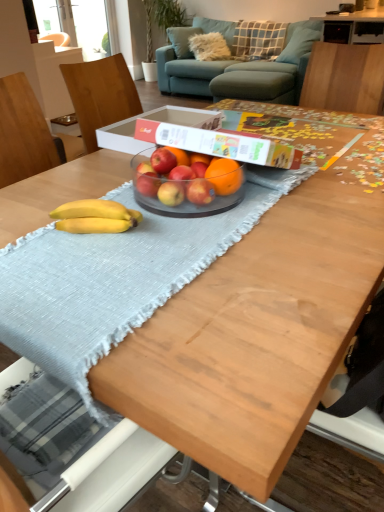
Question: Could you tell me if yellow matte bananas at center is facing red matte apple at center, acting as the fourth apple starting from the left?

Choices:
 (A) yes
 (B) no

Answer: (B)

Question: From a real-world perspective, is yellow matte bananas at center located beneath red matte apple at center, which is the 2th apple in right-to-left order?

Choices:
 (A) no
 (B) yes

Answer: (B)

Question: From the image's perspective, is yellow matte bananas at center under red matte apple at center, acting as the fourth apple starting from the left?

Choices:
 (A) no
 (B) yes

Answer: (B)

Question: Is yellow matte bananas at center at the left side of red matte apple at center, which is the 2th apple in right-to-left order?

Choices:
 (A) yes
 (B) no

Answer: (A)

Question: From the image's perspective, is yellow matte bananas at center on red matte apple at center, which is the 2th apple in right-to-left order?

Choices:
 (A) yes
 (B) no

Answer: (B)

Question: Based on their sizes in the image, would you say red matte apple at center, marked as the 5th apple in a left-to-right arrangement, is bigger or smaller than teal fabric couch at upper center?

Choices:
 (A) big
 (B) small

Answer: (B)

Question: From their relative heights in the image, would you say red matte apple at center, marked as the 1th apple in a right-to-left arrangement, is taller or shorter than teal fabric couch at upper center?

Choices:
 (A) short
 (B) tall

Answer: (A)

Question: From a real-world perspective, relative to teal fabric couch at upper center, is red matte apple at center, marked as the 5th apple in a left-to-right arrangement, vertically above or below?

Choices:
 (A) below
 (B) above

Answer: (B)

Question: In terms of width, does red matte apple at center, marked as the 5th apple in a left-to-right arrangement, look wider or thinner when compared to teal fabric couch at upper center?

Choices:
 (A) wide
 (B) thin

Answer: (B)

Question: From the image's perspective, is plaid fabric pillow at upper center, the second pillow from the front, positioned above or below blue fabric pillow at upper right, the 2th pillow in the back-to-front sequence?

Choices:
 (A) above
 (B) below

Answer: (A)

Question: Would you say plaid fabric pillow at upper center, placed as the 1th pillow when sorted from back to front, is to the left or to the right of blue fabric pillow at upper right, the 2th pillow in the back-to-front sequence, in the picture?

Choices:
 (A) right
 (B) left

Answer: (B)

Question: Is plaid fabric pillow at upper center, placed as the 1th pillow when sorted from back to front, situated inside blue fabric pillow at upper right, marked as the 1th pillow in a front-to-back arrangement, or outside?

Choices:
 (A) inside
 (B) outside

Answer: (B)

Question: Looking at their shapes, would you say plaid fabric pillow at upper center, placed as the 1th pillow when sorted from back to front, is wider or thinner than blue fabric pillow at upper right, marked as the 1th pillow in a front-to-back arrangement?

Choices:
 (A) wide
 (B) thin

Answer: (B)

Question: From their relative heights in the image, would you say red matte apple at center, which is the 1th apple from left to right, is taller or shorter than plaid fabric pillow at upper center, the second pillow from the front?

Choices:
 (A) short
 (B) tall

Answer: (A)

Question: From a real-world perspective, is red matte apple at center, which is the 1th apple from left to right, above or below plaid fabric pillow at upper center, the second pillow from the front?

Choices:
 (A) below
 (B) above

Answer: (B)